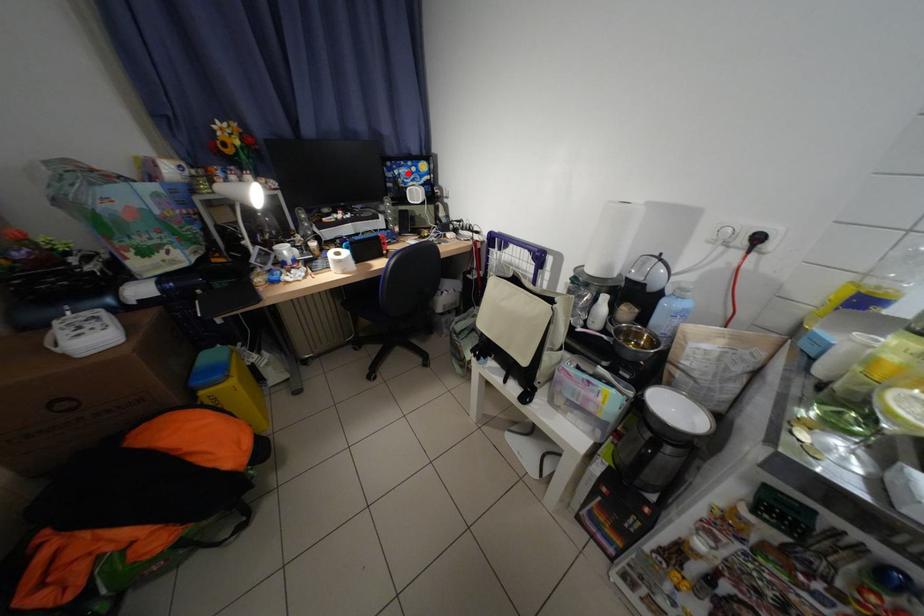
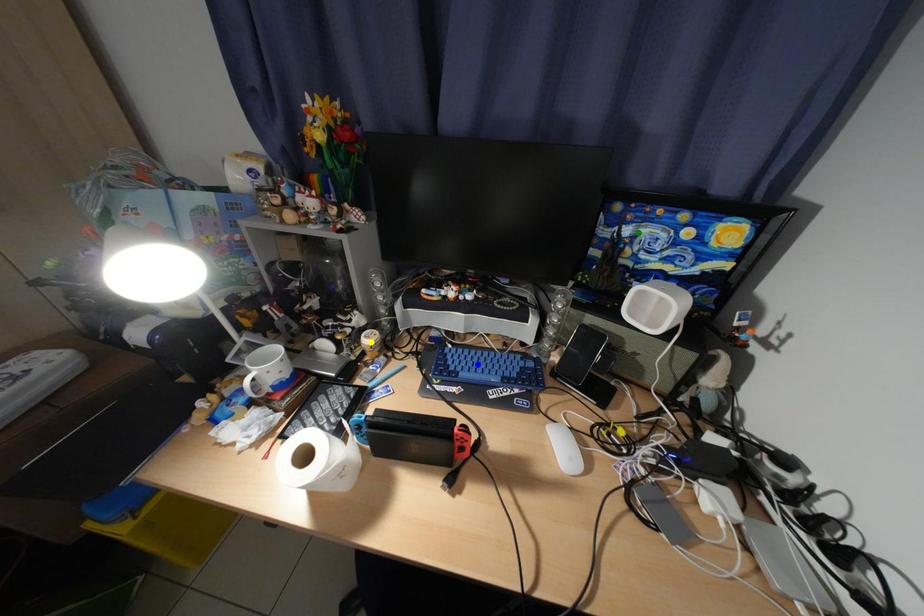
Question: I am providing you with two images of the same scene from different viewpoints. A red point is marked on the first image. You are given multiple points on the second image. Which point in image 2 is actually the same real-world point as the red point in image 1?

Choices:
 (A) blue point
 (B) yellow point
 (C) green point

Answer: (C)